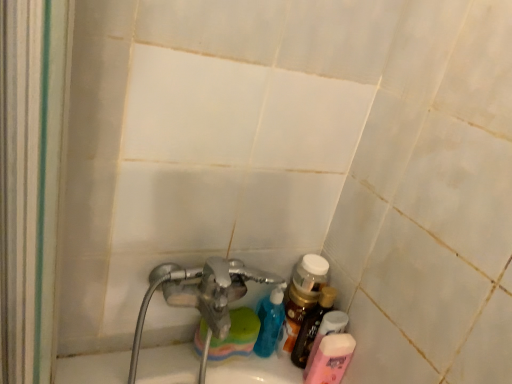
Question: From a real-world perspective, is translucent plastic bottle at lower right, the 1th toiletry when ordered from top to bottom, physically above pink matte lotion at lower right, the 2th toiletry positioned from the top?

Choices:
 (A) no
 (B) yes

Answer: (B)

Question: Is translucent plastic bottle at lower right, the 1th toiletry when ordered from top to bottom, completely or partially outside of pink matte lotion at lower right, the 2th toiletry positioned from the top?

Choices:
 (A) yes
 (B) no

Answer: (A)

Question: From the image's perspective, is translucent plastic bottle at lower right, the 1th toiletry when ordered from top to bottom, under pink matte lotion at lower right, the 2th toiletry positioned from the top?

Choices:
 (A) no
 (B) yes

Answer: (A)

Question: From the image's perspective, is translucent plastic bottle at lower right, placed as the 2th toiletry when sorted from bottom to top, above pink matte lotion at lower right, the 2th toiletry positioned from the top?

Choices:
 (A) no
 (B) yes

Answer: (B)

Question: Is there a large distance between translucent plastic bottle at lower right, placed as the 2th toiletry when sorted from bottom to top, and pink matte lotion at lower right, marked as the first toiletry in a bottom-to-top arrangement?

Choices:
 (A) no
 (B) yes

Answer: (A)

Question: From the image's perspective, is pink matte lotion at lower right, marked as the first toiletry in a bottom-to-top arrangement, above or below translucent plastic bottle at lower right?

Choices:
 (A) below
 (B) above

Answer: (A)

Question: In terms of size, does pink matte lotion at lower right, marked as the first toiletry in a bottom-to-top arrangement, appear bigger or smaller than translucent plastic bottle at lower right?

Choices:
 (A) big
 (B) small

Answer: (A)

Question: Is point coord(335,375) closer or farther from the camera than point coord(326,292)?

Choices:
 (A) farther
 (B) closer

Answer: (B)

Question: Considering the positions of pink matte lotion at lower right, marked as the first toiletry in a bottom-to-top arrangement, and translucent plastic bottle at lower right in the image, is pink matte lotion at lower right, marked as the first toiletry in a bottom-to-top arrangement, taller or shorter than translucent plastic bottle at lower right?

Choices:
 (A) tall
 (B) short

Answer: (B)

Question: In terms of height, does translucent plastic bottle at lower right, the 1th toiletry when ordered from top to bottom, look taller or shorter compared to pink matte lotion at lower right, marked as the first toiletry in a bottom-to-top arrangement?

Choices:
 (A) short
 (B) tall

Answer: (B)

Question: Based on their sizes in the image, would you say translucent plastic bottle at lower right, the 1th toiletry when ordered from top to bottom, is bigger or smaller than pink matte lotion at lower right, the 2th toiletry positioned from the top?

Choices:
 (A) small
 (B) big

Answer: (A)

Question: Is translucent plastic bottle at lower right, the 1th toiletry when ordered from top to bottom, wider or thinner than pink matte lotion at lower right, the 2th toiletry positioned from the top?

Choices:
 (A) thin
 (B) wide

Answer: (A)

Question: From a real-world perspective, is translucent plastic bottle at lower right, the 1th toiletry when ordered from top to bottom, above or below pink matte lotion at lower right, marked as the first toiletry in a bottom-to-top arrangement?

Choices:
 (A) above
 (B) below

Answer: (A)

Question: From their relative heights in the image, would you say pink matte lotion at lower right, marked as the first toiletry in a bottom-to-top arrangement, is taller or shorter than translucent plastic bottle at lower right, the 1th toiletry when ordered from top to bottom?

Choices:
 (A) short
 (B) tall

Answer: (A)

Question: Relative to translucent plastic bottle at lower right, placed as the 2th toiletry when sorted from bottom to top, is pink matte lotion at lower right, the 2th toiletry positioned from the top, in front or behind?

Choices:
 (A) front
 (B) behind

Answer: (A)